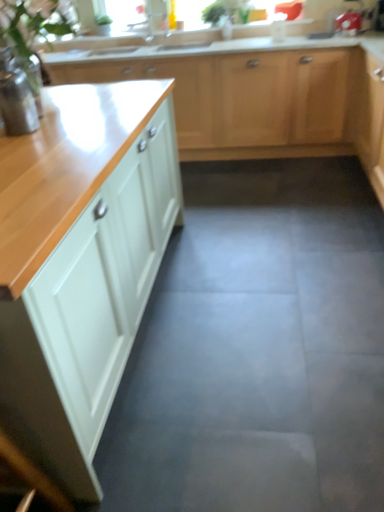
How much space does matte white cabinets at upper center, marked as the second cabinetry in a bottom-to-top arrangement, occupy horizontally?

24.15 inches.

The height and width of the screenshot is (512, 384). Identify the location of white glossy cabinet at left, the first cabinetry from the front. point(80,263).

From the image's perspective, is matte white cabinets at upper center, marked as the second cabinetry in a bottom-to-top arrangement, above white glossy cabinet at left, arranged as the first cabinetry when ordered from the bottom?

Yes, from the image's perspective, matte white cabinets at upper center, marked as the second cabinetry in a bottom-to-top arrangement, is on top of white glossy cabinet at left, arranged as the first cabinetry when ordered from the bottom.

Does matte white cabinets at upper center, which ranks as the 1th cabinetry in back-to-front order, appear on the right side of white glossy cabinet at left, the first cabinetry from the front?

Correct, you'll find matte white cabinets at upper center, which ranks as the 1th cabinetry in back-to-front order, to the right of white glossy cabinet at left, the first cabinetry from the front.

Would you say matte white cabinets at upper center, which is counted as the first cabinetry, starting from the top, is outside white glossy cabinet at left, arranged as the first cabinetry when ordered from the bottom?

matte white cabinets at upper center, which is counted as the first cabinetry, starting from the top, is positioned outside white glossy cabinet at left, arranged as the first cabinetry when ordered from the bottom.

Which is nearer, (312,86) or (79,231)?

The point (79,231) is closer.

How many degrees apart are the facing directions of white glossy cabinet at left, which is the 2th cabinetry from top to bottom, and matte white cabinets at upper center, which is counted as the first cabinetry, starting from the top?

The angle between the facing direction of white glossy cabinet at left, which is the 2th cabinetry from top to bottom, and the facing direction of matte white cabinets at upper center, which is counted as the first cabinetry, starting from the top, is 89.3 degrees.

Is white glossy cabinet at left, which is the 2th cabinetry from top to bottom, not inside matte white cabinets at upper center, marked as the second cabinetry in a bottom-to-top arrangement?

white glossy cabinet at left, which is the 2th cabinetry from top to bottom, is positioned outside matte white cabinets at upper center, marked as the second cabinetry in a bottom-to-top arrangement.

Is white glossy cabinet at left, which is the 2th cabinetry from top to bottom, not near matte white cabinets at upper center, which ranks as the 1th cabinetry in back-to-front order?

white glossy cabinet at left, which is the 2th cabinetry from top to bottom, is positioned a significant distance from matte white cabinets at upper center, which ranks as the 1th cabinetry in back-to-front order.

Is white glossy cabinet at left, the first cabinetry from the front, facing towards matte white cabinets at upper center, which ranks as the 1th cabinetry in back-to-front order?

No.

Considering the points (219, 12) and (273, 99), which point is in front, point (219, 12) or point (273, 99)?

The point (273, 99) is closer to the camera.

Consider the image. Does green leafy plant at upper center have a lesser width compared to matte white cabinets at upper center, marked as the second cabinetry in a bottom-to-top arrangement?

Correct, the width of green leafy plant at upper center is less than that of matte white cabinets at upper center, marked as the second cabinetry in a bottom-to-top arrangement.

Is green leafy plant at upper center not close to matte white cabinets at upper center, which ranks as the 1th cabinetry in back-to-front order?

Yes, green leafy plant at upper center and matte white cabinets at upper center, which ranks as the 1th cabinetry in back-to-front order, are located far from each other.

Considering the sizes of objects green leafy plant at upper center and matte white cabinets at upper center, which ranks as the 1th cabinetry in back-to-front order, in the image provided, who is shorter, green leafy plant at upper center or matte white cabinets at upper center, which ranks as the 1th cabinetry in back-to-front order,?

green leafy plant at upper center is shorter.

Is green leafy plant at upper center thinner than white glossy cabinet at left, which is the 2th cabinetry from top to bottom?

Correct, the width of green leafy plant at upper center is less than that of white glossy cabinet at left, which is the 2th cabinetry from top to bottom.

Which object is closer to the camera, green leafy plant at upper center or white glossy cabinet at left, the first cabinetry from the front?

white glossy cabinet at left, the first cabinetry from the front, is in front.

Image resolution: width=384 pixels, height=512 pixels. Find the location of `plant on the right of white glossy cabinet at left, the first cabinetry from the front`. plant on the right of white glossy cabinet at left, the first cabinetry from the front is located at coordinates (213, 13).

Does green leafy plant at upper center have a greater height compared to gray concrete floor at center?

No, green leafy plant at upper center is not taller than gray concrete floor at center.

Is green leafy plant at upper center at the left side of gray concrete floor at center?

In fact, green leafy plant at upper center is to the right of gray concrete floor at center.

From the image's perspective, is green leafy plant at upper center above or below gray concrete floor at center?

green leafy plant at upper center is above gray concrete floor at center.

Between green leafy plant at upper center and gray concrete floor at center, which one has smaller size?

Smaller between the two is green leafy plant at upper center.

Does gray concrete floor at center lie in front of white glossy cabinet at left, the second cabinetry viewed from the back?

Yes, gray concrete floor at center is closer to the viewer.

Is gray concrete floor at center positioned beyond the bounds of white glossy cabinet at left, which is the 2th cabinetry from top to bottom?

Yes, gray concrete floor at center is located beyond the bounds of white glossy cabinet at left, which is the 2th cabinetry from top to bottom.

Is gray concrete floor at center positioned far away from white glossy cabinet at left, the first cabinetry from the front?

No, gray concrete floor at center is not far away from white glossy cabinet at left, the first cabinetry from the front.

Can you see gray concrete floor at center touching matte white cabinets at upper center, marked as the second cabinetry in a bottom-to-top arrangement?

No, gray concrete floor at center is not with matte white cabinets at upper center, marked as the second cabinetry in a bottom-to-top arrangement.

Considering the points (173, 420) and (182, 93), which point is in front, point (173, 420) or point (182, 93)?

The point (173, 420) is closer to the camera.

From the image's perspective, does gray concrete floor at center appear higher than matte white cabinets at upper center, marked as the second cabinetry in a bottom-to-top arrangement?

No, from the image's perspective, gray concrete floor at center is not on top of matte white cabinets at upper center, marked as the second cabinetry in a bottom-to-top arrangement.

Which object is more forward, gray concrete floor at center or matte white cabinets at upper center, which is the second cabinetry in front-to-back order?

gray concrete floor at center is in front.

The width and height of the screenshot is (384, 512). Identify the location of cabinetry that is behind the white glossy cabinet at left, which is the 2th cabinetry from top to bottom. (259, 95).

The width and height of the screenshot is (384, 512). Identify the location of cabinetry below the white glossy cabinet at left, arranged as the first cabinetry when ordered from the bottom (from a real-world perspective). click(x=259, y=95).

Which object lies further to the anchor point white glossy cabinet at left, the second cabinetry viewed from the back, gray concrete floor at center or green leafy plant at upper center?

green leafy plant at upper center is positioned further to the anchor white glossy cabinet at left, the second cabinetry viewed from the back.

From the image, which object appears to be nearer to matte white cabinets at upper center, which ranks as the 1th cabinetry in back-to-front order, gray concrete floor at center or green leafy plant at upper center?

green leafy plant at upper center is positioned closer to the anchor matte white cabinets at upper center, which ranks as the 1th cabinetry in back-to-front order.

Looking at the image, which one is located closer to green leafy plant at upper center, matte white cabinets at upper center, which ranks as the 1th cabinetry in back-to-front order, or white glossy cabinet at left, the second cabinetry viewed from the back?

matte white cabinets at upper center, which ranks as the 1th cabinetry in back-to-front order.

Based on their spatial positions, is white glossy cabinet at left, arranged as the first cabinetry when ordered from the bottom, or green leafy plant at upper center closer to matte white cabinets at upper center, marked as the second cabinetry in a bottom-to-top arrangement?

green leafy plant at upper center.

Looking at the image, which one is located closer to green leafy plant at upper center, white glossy cabinet at left, which is the 2th cabinetry from top to bottom, or matte white cabinets at upper center, which is counted as the first cabinetry, starting from the top?

The object closer to green leafy plant at upper center is matte white cabinets at upper center, which is counted as the first cabinetry, starting from the top.

When comparing their distances from matte white cabinets at upper center, which ranks as the 1th cabinetry in back-to-front order, does green leafy plant at upper center or white glossy cabinet at left, the second cabinetry viewed from the back, seem further?

white glossy cabinet at left, the second cabinetry viewed from the back.

Looking at the image, which one is located further to white glossy cabinet at left, the second cabinetry viewed from the back, green leafy plant at upper center or gray concrete floor at center?

green leafy plant at upper center lies further to white glossy cabinet at left, the second cabinetry viewed from the back, than the other object.

Considering their positions, is white glossy cabinet at left, the second cabinetry viewed from the back, positioned further to gray concrete floor at center than matte white cabinets at upper center, which is counted as the first cabinetry, starting from the top?

matte white cabinets at upper center, which is counted as the first cabinetry, starting from the top, is further to gray concrete floor at center.

Where is `cabinetry between gray concrete floor at center and matte white cabinets at upper center, which is counted as the first cabinetry, starting from the top, in the front-back direction`? cabinetry between gray concrete floor at center and matte white cabinets at upper center, which is counted as the first cabinetry, starting from the top, in the front-back direction is located at coordinates (x=80, y=263).

Image resolution: width=384 pixels, height=512 pixels. Identify the location of cabinetry between white glossy cabinet at left, the first cabinetry from the front, and green leafy plant at upper center from front to back. (259, 95).